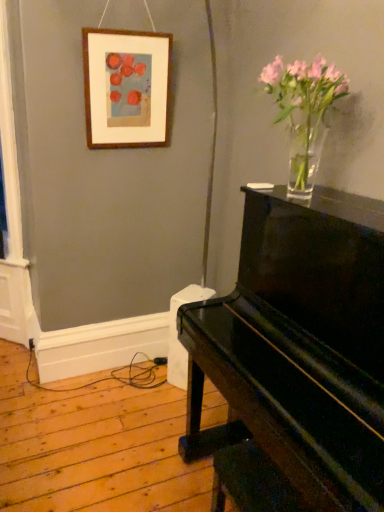
Find the location of a particular element. wooden picture frame at upper left is located at coordinates (125, 87).

Where is `wooden picture frame at upper left`? wooden picture frame at upper left is located at coordinates (125, 87).

Is glossy black piano at right oriented towards wooden picture frame at upper left?

No, glossy black piano at right is not turned towards wooden picture frame at upper left.

Which object is wider, glossy black piano at right or wooden picture frame at upper left?

With larger width is glossy black piano at right.

Is wooden picture frame at upper left surrounded by glossy black piano at right?

No, glossy black piano at right does not contain wooden picture frame at upper left.

Does glossy black piano at right have a lesser height compared to wooden picture frame at upper left?

No, glossy black piano at right is not shorter than wooden picture frame at upper left.

Is wooden picture frame at upper left directly adjacent to clear glass vase at upper right?

They are not placed beside each other.

Does wooden picture frame at upper left have a larger size compared to clear glass vase at upper right?

Incorrect, wooden picture frame at upper left is not larger than clear glass vase at upper right.

Is wooden picture frame at upper left aimed at clear glass vase at upper right?

Yes, wooden picture frame at upper left is aimed at clear glass vase at upper right.

Is point (132, 112) closer or farther from the camera than point (294, 98)?

Point (132, 112) appears to be farther away from the viewer than point (294, 98).

Is glossy black piano at right outside of clear glass vase at upper right?

Yes, glossy black piano at right is outside of clear glass vase at upper right.

Considering the relative sizes of glossy black piano at right and clear glass vase at upper right in the image provided, is glossy black piano at right shorter than clear glass vase at upper right?

No.

Considering the relative positions of glossy black piano at right and clear glass vase at upper right in the image provided, is glossy black piano at right to the left of clear glass vase at upper right from the viewer's perspective?

In fact, glossy black piano at right is to the right of clear glass vase at upper right.

Is glossy black piano at right looking in the opposite direction of clear glass vase at upper right?

No, clear glass vase at upper right is not at the back of glossy black piano at right.

From the image's perspective, who appears lower, clear glass vase at upper right or wooden picture frame at upper left?

clear glass vase at upper right is shown below in the image.

Can we say clear glass vase at upper right lies outside wooden picture frame at upper left?

That's correct, clear glass vase at upper right is outside of wooden picture frame at upper left.

From a real-world perspective, is clear glass vase at upper right physically below wooden picture frame at upper left?

Yes, from a real-world perspective, clear glass vase at upper right is beneath wooden picture frame at upper left.

Locate an element on the screen. The image size is (384, 512). picture frame above the clear glass vase at upper right (from a real-world perspective) is located at coordinates (125, 87).

Is wooden picture frame at upper left not close to glossy black piano at right?

Absolutely, wooden picture frame at upper left is distant from glossy black piano at right.

From the image's perspective, between wooden picture frame at upper left and glossy black piano at right, who is located below?

glossy black piano at right.

Considering the sizes of wooden picture frame at upper left and glossy black piano at right in the image, is wooden picture frame at upper left bigger or smaller than glossy black piano at right?

In the image, wooden picture frame at upper left appears to be smaller than glossy black piano at right.

Is wooden picture frame at upper left completely or partially outside of glossy black piano at right?

wooden picture frame at upper left lies outside glossy black piano at right's area.

Between clear glass vase at upper right and glossy black piano at right, which one has more height?

glossy black piano at right.

Is clear glass vase at upper right located outside glossy black piano at right?

Absolutely, clear glass vase at upper right is external to glossy black piano at right.

Which of these two, clear glass vase at upper right or glossy black piano at right, is bigger?

glossy black piano at right is bigger.

Which is further, (272, 63) or (334, 353)?

Positioned behind is point (272, 63).

Image resolution: width=384 pixels, height=512 pixels. What are the coordinates of `piano in front of the wooden picture frame at upper left` in the screenshot? It's located at (295, 358).

Where is `floral arrangement located underneath the wooden picture frame at upper left (from a real-world perspective)`? The height and width of the screenshot is (512, 384). floral arrangement located underneath the wooden picture frame at upper left (from a real-world perspective) is located at coordinates (304, 113).

Based on their spatial positions, is glossy black piano at right or clear glass vase at upper right closer to wooden picture frame at upper left?

Among the two, clear glass vase at upper right is located nearer to wooden picture frame at upper left.

Looking at the image, which one is located closer to glossy black piano at right, clear glass vase at upper right or wooden picture frame at upper left?

The object closer to glossy black piano at right is clear glass vase at upper right.

When comparing their distances from clear glass vase at upper right, does wooden picture frame at upper left or glossy black piano at right seem further?

Based on the image, wooden picture frame at upper left appears to be further to clear glass vase at upper right.

Based on their spatial positions, is glossy black piano at right or wooden picture frame at upper left further from clear glass vase at upper right?

Based on the image, wooden picture frame at upper left appears to be further to clear glass vase at upper right.

When comparing their distances from glossy black piano at right, does wooden picture frame at upper left or clear glass vase at upper right seem closer?

Based on the image, clear glass vase at upper right appears to be nearer to glossy black piano at right.

Based on their spatial positions, is clear glass vase at upper right or glossy black piano at right closer to wooden picture frame at upper left?

clear glass vase at upper right lies closer to wooden picture frame at upper left than the other object.

In order to click on floral arrangement between wooden picture frame at upper left and glossy black piano at right from top to bottom in this screenshot , I will do coord(304,113).